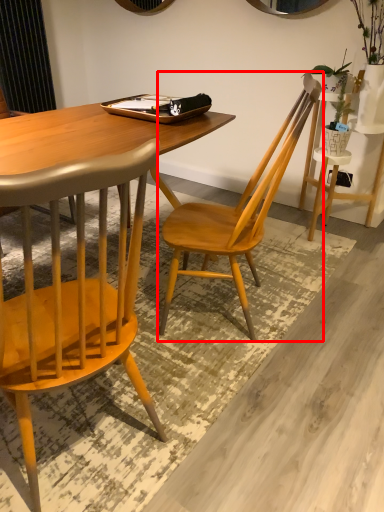
Question: Where is chair (annotated by the red box) located in relation to chair in the image?

Choices:
 (A) right
 (B) left

Answer: (A)